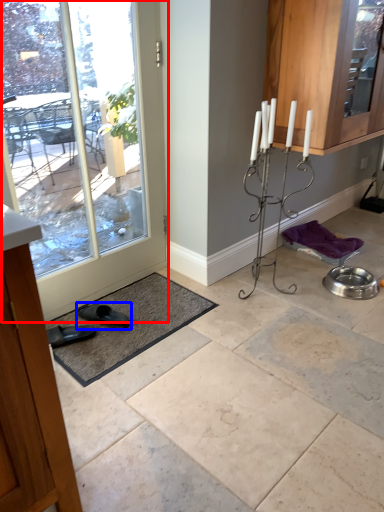
Question: Which point is further to the camera, door (highlighted by a red box) or footwear (highlighted by a blue box)?

Choices:
 (A) door
 (B) footwear

Answer: (B)